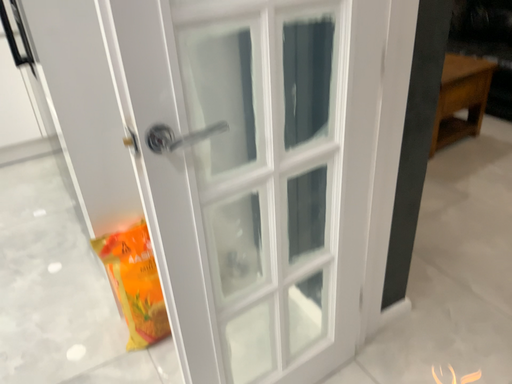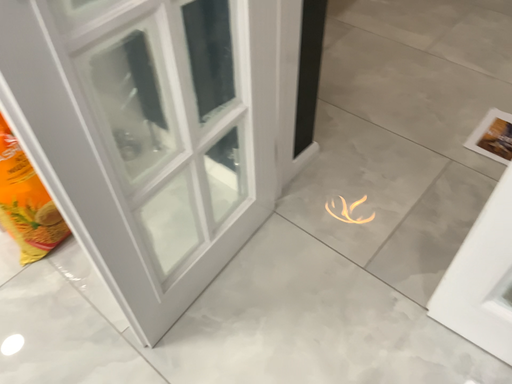
Question: Which way did the camera rotate in the video?

Choices:
 (A) rotated left
 (B) rotated right

Answer: (B)